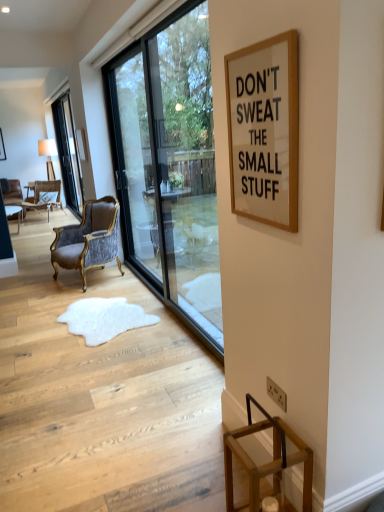
Question: Is velvet upholstered chair at left, which is the 2th chair in bottom-to-top order, bigger than white fur rug at center?

Choices:
 (A) yes
 (B) no

Answer: (A)

Question: Could you tell me if velvet upholstered chair at left, positioned as the 1th chair in back-to-front order, is turned towards white fur rug at center?

Choices:
 (A) yes
 (B) no

Answer: (B)

Question: Is velvet upholstered chair at left, positioned as the 1th chair in back-to-front order, completely or partially outside of white fur rug at center?

Choices:
 (A) no
 (B) yes

Answer: (B)

Question: Is white fur rug at center completely or partially inside velvet upholstered chair at left, positioned as the 1th chair in back-to-front order?

Choices:
 (A) yes
 (B) no

Answer: (B)

Question: Does velvet upholstered chair at left, placed as the first chair when sorted from left to right, appear on the right side of white fur rug at center?

Choices:
 (A) yes
 (B) no

Answer: (B)

Question: Is white fur rug at center at the back of velvet upholstered chair at left, the second chair from the front?

Choices:
 (A) yes
 (B) no

Answer: (B)

Question: Considering the relative sizes of velvet upholstered armchair at center, which appears as the 1th chair when viewed from the front, and white fur rug at center in the image provided, is velvet upholstered armchair at center, which appears as the 1th chair when viewed from the front, bigger than white fur rug at center?

Choices:
 (A) no
 (B) yes

Answer: (B)

Question: Can you confirm if velvet upholstered armchair at center, positioned as the 2th chair in left-to-right order, is wider than white fur rug at center?

Choices:
 (A) yes
 (B) no

Answer: (B)

Question: Can we say velvet upholstered armchair at center, which appears as the 1th chair when viewed from the front, lies outside white fur rug at center?

Choices:
 (A) no
 (B) yes

Answer: (B)

Question: Can you confirm if velvet upholstered armchair at center, which appears as the first chair when viewed from the right, is taller than white fur rug at center?

Choices:
 (A) yes
 (B) no

Answer: (A)

Question: Is velvet upholstered armchair at center, which appears as the 1th chair when ordered from the bottom, smaller than white fur rug at center?

Choices:
 (A) yes
 (B) no

Answer: (B)

Question: Is velvet upholstered armchair at center, which appears as the 1th chair when viewed from the front, oriented towards white fur rug at center?

Choices:
 (A) no
 (B) yes

Answer: (A)

Question: Is clear glass window at left, which is the first window from left to right, completely or partially inside white paperboard at upper right?

Choices:
 (A) no
 (B) yes

Answer: (A)